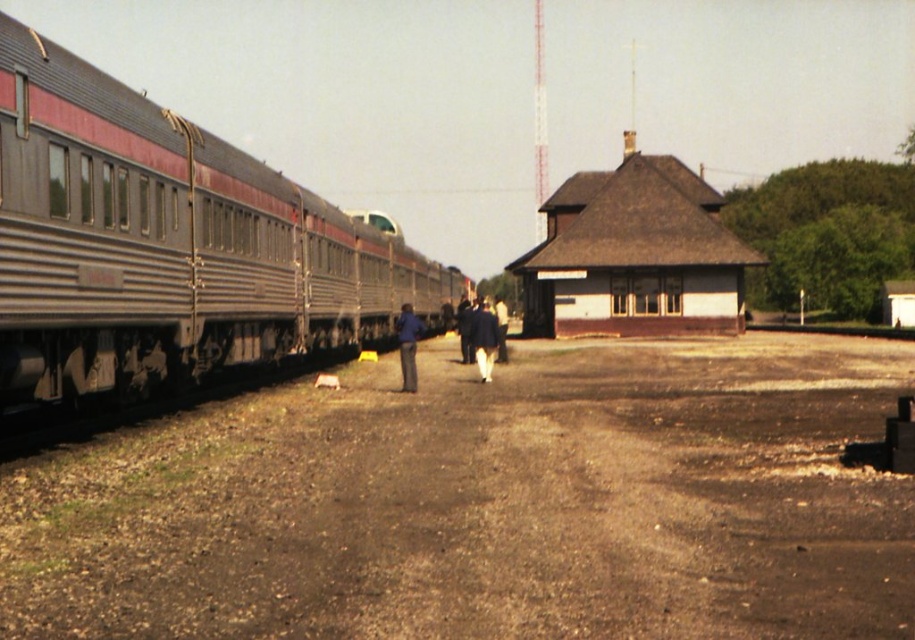
Question: Does metal train track at center appear on the right side of dark blue suit at center?

Choices:
 (A) yes
 (B) no

Answer: (A)

Question: Which is nearer to the silver metallic train at left?

Choices:
 (A) white fabric pants at center
 (B) blue fabric jacket at center
 (C) metal train track at center

Answer: (B)

Question: Is silver metallic train at left below metal train track at center?

Choices:
 (A) yes
 (B) no

Answer: (B)

Question: Which point appears farthest from the camera in this image?

Choices:
 (A) pos(490,321)
 (B) pos(634,448)
 (C) pos(503,305)

Answer: (C)

Question: Which point appears closest to the camera in this image?

Choices:
 (A) (750, 324)
 (B) (504, 355)
 (C) (394, 556)

Answer: (C)

Question: Is brown gravel dirt track at center behind blue fabric jacket at center?

Choices:
 (A) no
 (B) yes

Answer: (A)